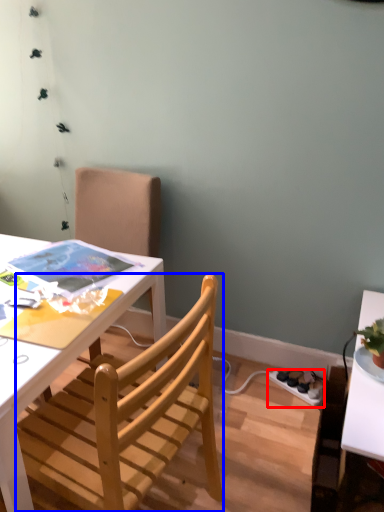
Question: Among these objects, which one is nearest to the camera, power outlet (highlighted by a red box) or chair (highlighted by a blue box)?

Choices:
 (A) power outlet
 (B) chair

Answer: (B)